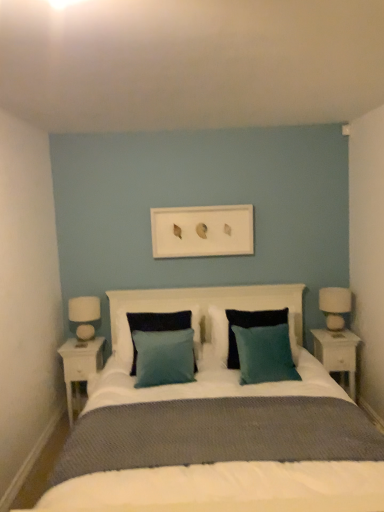
What do you see at coordinates (265, 354) in the screenshot?
I see `teal fabric pillow at center, the third pillow positioned from the left` at bounding box center [265, 354].

Locate an element on the screen. This screenshot has height=512, width=384. teal fabric pillow at center, the third pillow positioned from the left is located at coordinates (265, 354).

What do you see at coordinates (80, 364) in the screenshot? The height and width of the screenshot is (512, 384). I see `white wood nightstand at left, the 1th nightstand positioned from the left` at bounding box center [80, 364].

Describe the element at coordinates (84, 317) in the screenshot. This screenshot has width=384, height=512. I see `white glossy table lamp at left` at that location.

The height and width of the screenshot is (512, 384). In order to click on teal fabric pillow at center, placed as the 2th pillow when sorted from right to left in this screenshot , I will do `click(242, 326)`.

Image resolution: width=384 pixels, height=512 pixels. What are the coordinates of `white glossy nightstand at right, placed as the second nightstand when sorted from left to right` in the screenshot? It's located at (337, 353).

Where is `teal fabric pillow at center, the third pillow positioned from the left`? teal fabric pillow at center, the third pillow positioned from the left is located at coordinates (265, 354).

Is teal fabric pillow at center, the third pillow positioned from the left, further to camera compared to teal fabric pillow at center, which is the 2th pillow in left-to-right order?

No, teal fabric pillow at center, the third pillow positioned from the left, is closer to the viewer.

Are teal fabric pillow at center, the third pillow positioned from the left, and teal fabric pillow at center, which is the 2th pillow in left-to-right order, located far from each other?

Actually, teal fabric pillow at center, the third pillow positioned from the left, and teal fabric pillow at center, which is the 2th pillow in left-to-right order, are a little close together.

Measure the distance between teal fabric pillow at center, the third pillow positioned from the left, and teal fabric pillow at center, placed as the 2th pillow when sorted from right to left.

They are 9.45 inches apart.

Would you say teal fabric pillow at center, the third pillow positioned from the left, is inside or outside teal fabric pillow at center, which is the 2th pillow in left-to-right order?

The correct answer is: outside.

Can you confirm if white glossy table lamp at left is smaller than white fabric lampshade at right?

Yes, white glossy table lamp at left is smaller than white fabric lampshade at right.

Consider the image. Can you tell me how much white glossy table lamp at left and white fabric lampshade at right differ in facing direction?

0.000421 degrees separate the facing orientations of white glossy table lamp at left and white fabric lampshade at right.

From a real-world perspective, is white glossy table lamp at left over white fabric lampshade at right?

Yes.

Is white glossy table lamp at left in front of white fabric lampshade at right?

Yes, the depth of white glossy table lamp at left is less than that of white fabric lampshade at right.

Does point (173, 248) come in front of point (99, 315)?

No, it is behind (99, 315).

How different are the orientations of white matte picture frame at center and white glossy table lamp at left in degrees?

There is a 1.37-degree angle between the facing directions of white matte picture frame at center and white glossy table lamp at left.

Is white matte picture frame at center wider than white glossy table lamp at left?

No.

Is white matte picture frame at center next to white glossy table lamp at left and touching it?

No, white matte picture frame at center is not in contact with white glossy table lamp at left.

Is white glossy nightstand at right, placed as the second nightstand when sorted from left to right, surrounded by white matte picture frame at center?

Definitely not — white glossy nightstand at right, placed as the second nightstand when sorted from left to right, is not inside white matte picture frame at center.

The width and height of the screenshot is (384, 512). In order to click on picture frame that is behind the white glossy nightstand at right, placed as the second nightstand when sorted from left to right in this screenshot , I will do `click(202, 231)`.

Considering the sizes of objects white matte picture frame at center and white glossy nightstand at right, the first nightstand in the right-to-left sequence, in the image provided, who is shorter, white matte picture frame at center or white glossy nightstand at right, the first nightstand in the right-to-left sequence,?

Standing shorter between the two is white matte picture frame at center.

Which object is positioned more to the right, white matte picture frame at center or white glossy nightstand at right, the first nightstand in the right-to-left sequence?

From the viewer's perspective, white glossy nightstand at right, the first nightstand in the right-to-left sequence, appears more on the right side.

Looking at this image, is teal fabric pillow at center, placed as the 2th pillow when sorted from right to left, positioned far away from white wood nightstand at left, acting as the 2th nightstand starting from the right?

Indeed, teal fabric pillow at center, placed as the 2th pillow when sorted from right to left, is not near white wood nightstand at left, acting as the 2th nightstand starting from the right.

Considering their positions, is teal fabric pillow at center, which is the 2th pillow in left-to-right order, located in front of or behind white wood nightstand at left, the 1th nightstand positioned from the left?

In the image, teal fabric pillow at center, which is the 2th pillow in left-to-right order, appears in front of white wood nightstand at left, the 1th nightstand positioned from the left.

From the image's perspective, between teal fabric pillow at center, placed as the 2th pillow when sorted from right to left, and white wood nightstand at left, acting as the 2th nightstand starting from the right, who is located below?

white wood nightstand at left, acting as the 2th nightstand starting from the right.

Is white wood nightstand at left, acting as the 2th nightstand starting from the right, at the back of teal fabric pillow at center, placed as the 2th pillow when sorted from right to left?

teal fabric pillow at center, placed as the 2th pillow when sorted from right to left, is not turned away from white wood nightstand at left, acting as the 2th nightstand starting from the right.

Where is `picture frame located on the left of white glossy nightstand at right, placed as the second nightstand when sorted from left to right`? picture frame located on the left of white glossy nightstand at right, placed as the second nightstand when sorted from left to right is located at coordinates (202, 231).

Is point (339, 337) closer or farther from the camera than point (207, 240)?

Point (339, 337) is closer to the camera than point (207, 240).

Is white glossy nightstand at right, placed as the second nightstand when sorted from left to right, positioned far away from white matte picture frame at center?

Yes, white glossy nightstand at right, placed as the second nightstand when sorted from left to right, and white matte picture frame at center are quite far apart.

Is white matte picture frame at center inside white glossy nightstand at right, the first nightstand in the right-to-left sequence?

No, white matte picture frame at center is not a part of white glossy nightstand at right, the first nightstand in the right-to-left sequence.

Measure the distance from white glossy nightstand at right, the first nightstand in the right-to-left sequence, to white wood nightstand at left, acting as the 2th nightstand starting from the right.

white glossy nightstand at right, the first nightstand in the right-to-left sequence, and white wood nightstand at left, acting as the 2th nightstand starting from the right, are 6.20 feet apart.

From their relative heights in the image, would you say white glossy nightstand at right, the first nightstand in the right-to-left sequence, is taller or shorter than white wood nightstand at left, acting as the 2th nightstand starting from the right?

white glossy nightstand at right, the first nightstand in the right-to-left sequence, is shorter than white wood nightstand at left, acting as the 2th nightstand starting from the right.

Which object is closer to the camera, white glossy nightstand at right, the first nightstand in the right-to-left sequence, or white wood nightstand at left, acting as the 2th nightstand starting from the right?

white wood nightstand at left, acting as the 2th nightstand starting from the right, is in front.

Looking at the image, does white glossy nightstand at right, placed as the second nightstand when sorted from left to right, seem bigger or smaller compared to white wood nightstand at left, the 1th nightstand positioned from the left?

In the image, white glossy nightstand at right, placed as the second nightstand when sorted from left to right, appears to be smaller than white wood nightstand at left, the 1th nightstand positioned from the left.

The image size is (384, 512). I want to click on pillow that is the 1st object to the left of the teal fabric pillow at center, the third pillow positioned from the left, starting at the anchor, so click(242, 326).

There is a white fabric lampshade at right. Where is `table lamp above it (from a real-world perspective)`? The width and height of the screenshot is (384, 512). table lamp above it (from a real-world perspective) is located at coordinates (84, 317).

Looking at the image, which one is located closer to white wood nightstand at left, acting as the 2th nightstand starting from the right, white fabric lampshade at right or teal fabric pillow at center, placed as the 2th pillow when sorted from right to left?

teal fabric pillow at center, placed as the 2th pillow when sorted from right to left, lies closer to white wood nightstand at left, acting as the 2th nightstand starting from the right, than the other object.

From the image, which object appears to be nearer to teal fabric pillow at center, placed as the 2th pillow when sorted from right to left, white fabric lampshade at right or teal fabric pillow at center, which is the 3th pillow in right-to-left order?

Among the two, teal fabric pillow at center, which is the 3th pillow in right-to-left order, is located nearer to teal fabric pillow at center, placed as the 2th pillow when sorted from right to left.

Which object lies further to the anchor point white matte picture frame at center, white wood nightstand at left, the 1th nightstand positioned from the left, or teal fabric pillow at center, positioned as the 1th pillow in left-to-right order?

Among the two, white wood nightstand at left, the 1th nightstand positioned from the left, is located further to white matte picture frame at center.

Based on their spatial positions, is teal fabric pillow at center, positioned as the 1th pillow in left-to-right order, or teal fabric pillow at center, which is the 2th pillow in left-to-right order, closer to white glossy table lamp at left?

teal fabric pillow at center, positioned as the 1th pillow in left-to-right order.

Estimate the real-world distances between objects in this image. Which object is closer to white wood nightstand at left, the 1th nightstand positioned from the left, white glossy nightstand at right, placed as the second nightstand when sorted from left to right, or white fabric lampshade at right?

white glossy nightstand at right, placed as the second nightstand when sorted from left to right, lies closer to white wood nightstand at left, the 1th nightstand positioned from the left, than the other object.

Looking at the image, which one is located closer to white wood nightstand at left, acting as the 2th nightstand starting from the right, white glossy table lamp at left or white glossy nightstand at right, placed as the second nightstand when sorted from left to right?

The object closer to white wood nightstand at left, acting as the 2th nightstand starting from the right, is white glossy table lamp at left.

Based on their spatial positions, is teal fabric pillow at center, placed as the 2th pillow when sorted from right to left, or white wood nightstand at left, the 1th nightstand positioned from the left, further from white fabric lampshade at right?

white wood nightstand at left, the 1th nightstand positioned from the left, is positioned further to the anchor white fabric lampshade at right.

When comparing their distances from white fabric lampshade at right, does white wood nightstand at left, the 1th nightstand positioned from the left, or white glossy nightstand at right, placed as the second nightstand when sorted from left to right, seem closer?

white glossy nightstand at right, placed as the second nightstand when sorted from left to right, lies closer to white fabric lampshade at right than the other object.

This screenshot has height=512, width=384. Identify the location of pillow between white matte picture frame at center and teal fabric pillow at center, which ranks as the first pillow in right-to-left order, in the vertical direction. (242, 326).

Image resolution: width=384 pixels, height=512 pixels. Identify the location of picture frame located between teal fabric pillow at center, positioned as the 1th pillow in left-to-right order, and white glossy nightstand at right, the first nightstand in the right-to-left sequence, in the left-right direction. (202, 231).

Find the location of a particular element. The height and width of the screenshot is (512, 384). table lamp between white wood nightstand at left, the 1th nightstand positioned from the left, and white fabric lampshade at right from left to right is located at coordinates (84, 317).

You are a GUI agent. You are given a task and a screenshot of the screen. Output one action in this format:
    pyautogui.click(x=<x>, y=<y>)
    Task: Click on the table lamp between white wood nightstand at left, the 1th nightstand positioned from the left, and teal fabric pillow at center, the third pillow positioned from the left
    Image resolution: width=384 pixels, height=512 pixels.
    Given the screenshot: What is the action you would take?
    pyautogui.click(x=84, y=317)